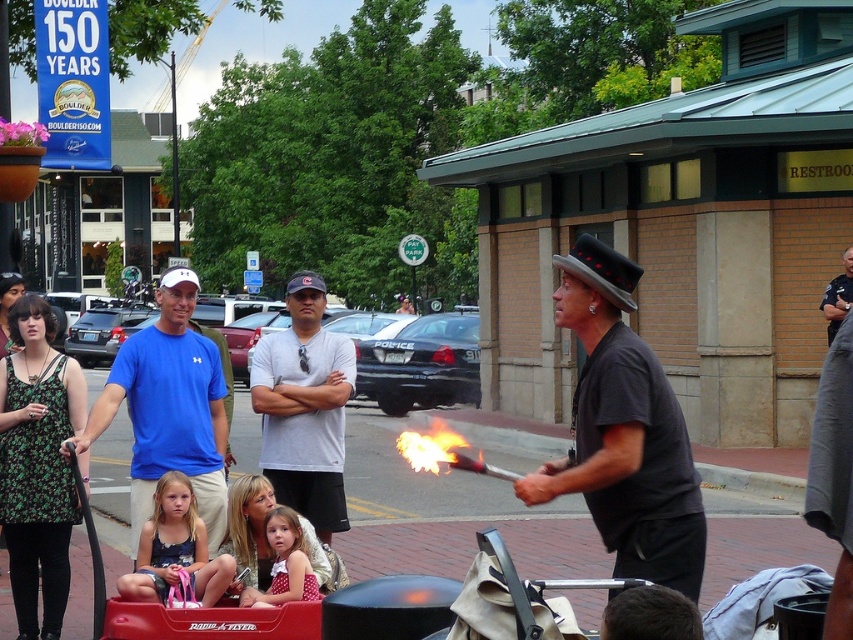
How far apart are dotted pink dress at center and flameliquidfire at center?

They are 1.12 meters apart.

Is dotted pink dress at center in front of flameliquidfire at center?

No, it is behind flameliquidfire at center.

Where is `dotted pink dress at center`? The width and height of the screenshot is (853, 640). dotted pink dress at center is located at coordinates (283, 563).

Between blue cotton shirt at center and dotted pink dress at center, which one appears on the left side from the viewer's perspective?

blue cotton shirt at center is more to the left.

Does blue cotton shirt at center have a lesser width compared to dotted pink dress at center?

No, blue cotton shirt at center is not thinner than dotted pink dress at center.

Who is more distant from viewer, (129,364) or (288,545)?

Point (129,364)

The width and height of the screenshot is (853, 640). I want to click on blue cotton shirt at center, so click(x=169, y=408).

Is black matte hat at center positioned in front of blue cotton shirt at center?

Yes, it is in front of blue cotton shirt at center.

Does point (578, 264) lie in front of point (146, 330)?

That is True.

Where is `black matte hat at center`? The width and height of the screenshot is (853, 640). black matte hat at center is located at coordinates (624, 432).